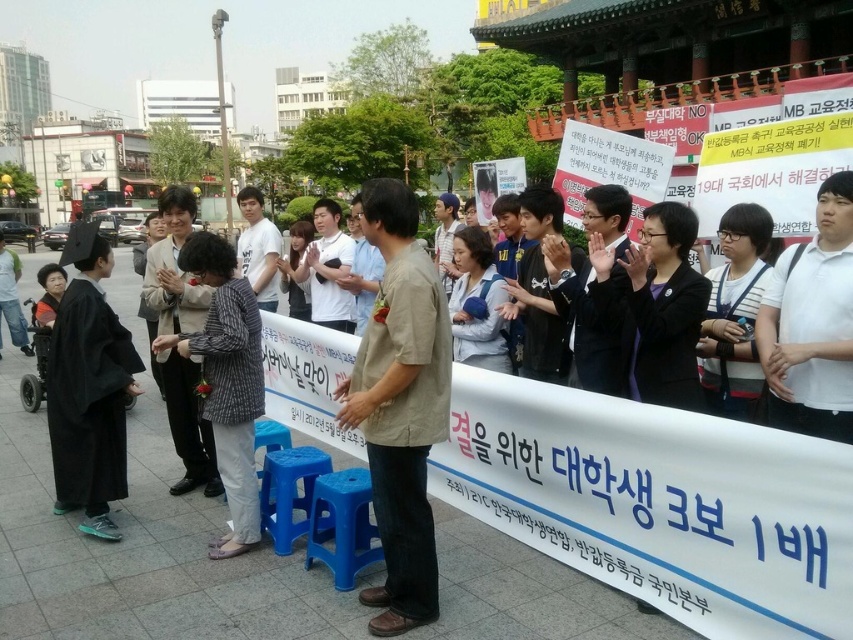
You are a photographer at the protest scene. You need to capture a photo where both the black matte graduation gown at left and the white cotton shirt at center are clearly visible. Based on their positions, which object should you focus on first to ensure both are in focus?

The black matte graduation gown at left is positioned under the white cotton shirt at center. To ensure both are in focus, you should focus on the white cotton shirt at center first since it is closer to the camera, and the graduation gown behind it will also be in focus if the depth of field is sufficient.